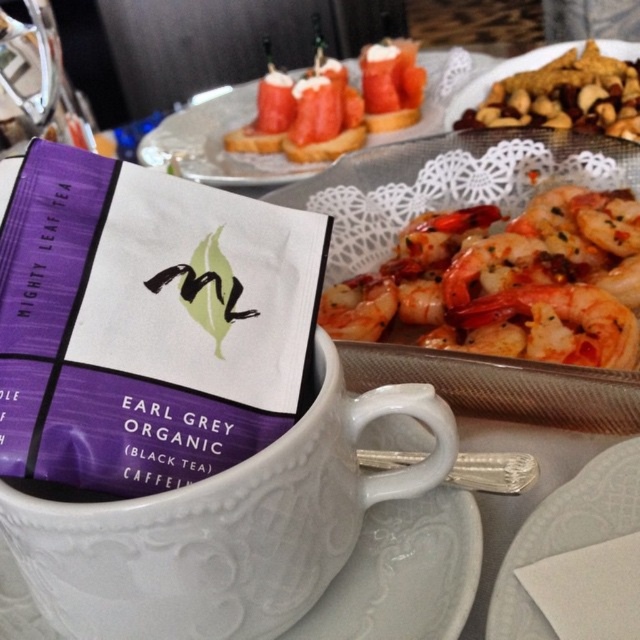
You are a guest at a tea party and want to place your napkin on the white lace doily at upper center. However, you notice the purple paper earl grey tea bag at center is blocking your way. Is the tea bag to the left or right of the doily?

The purple paper earl grey tea bag at center is to the left of the white lace doily at upper center, so it is blocking the path to the right side of the doily.

You are a tea lover who wants to place the purple paper earl grey tea bag at center and the white lace doily at upper center on a small plate. Which one will you place first to ensure they both fit?

The purple paper earl grey tea bag at center is bigger than the white lace doily at upper center, so you should place the white lace doily at upper center first to ensure there is enough space for the larger tea bag.